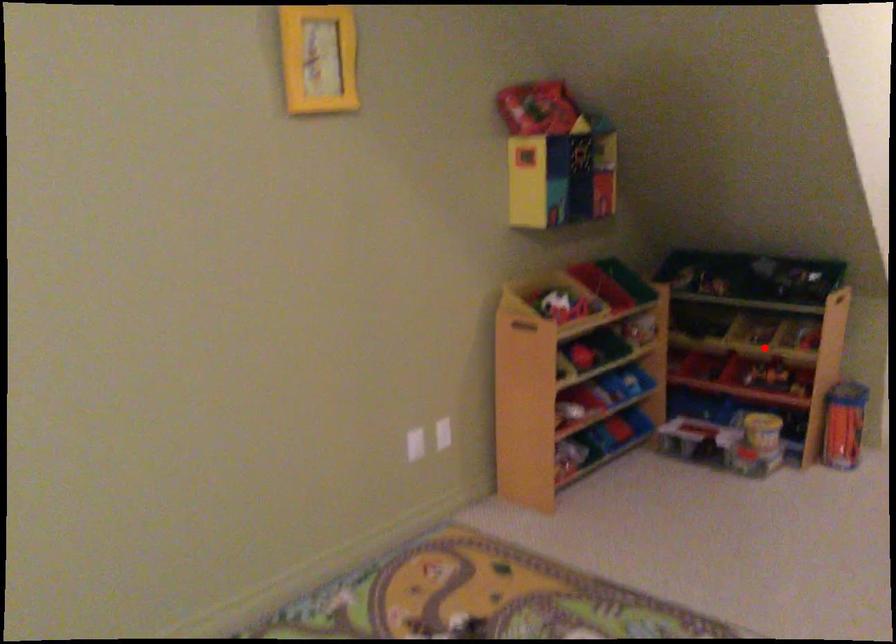
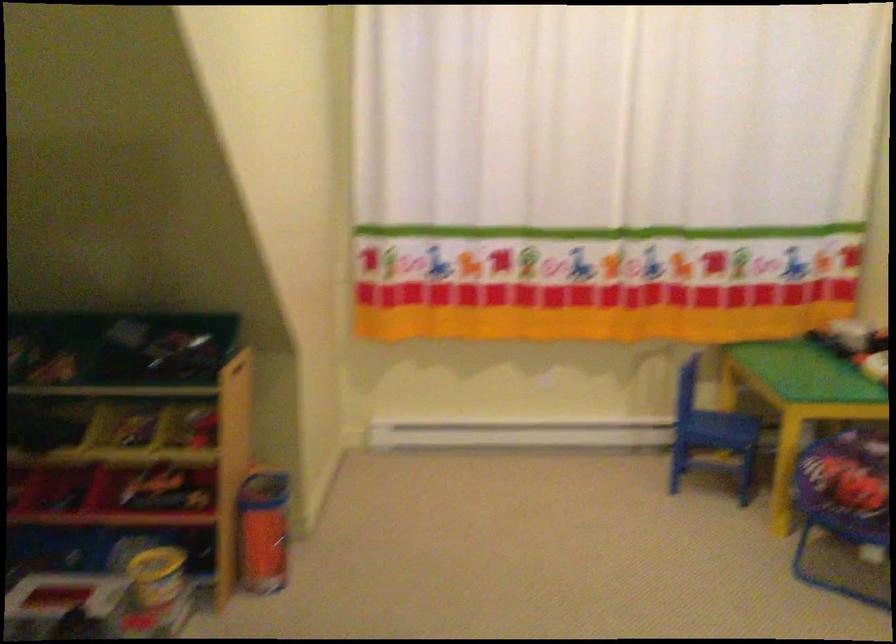
Question: I am providing you with two images of the same scene from different viewpoints. A red point is marked on the first image. Can you still see the location of the red point in image 2?

Choices:
 (A) Yes
 (B) No

Answer: (A)